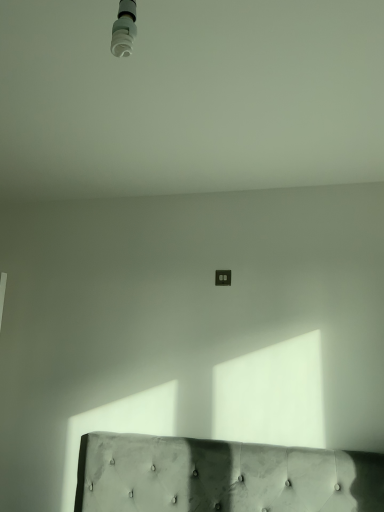
The height and width of the screenshot is (512, 384). In order to click on black plastic switch at center in this screenshot , I will do `click(223, 278)`.

What is the approximate height of black plastic switch at center?

black plastic switch at center is 3.45 inches tall.

The image size is (384, 512). Describe the element at coordinates (223, 278) in the screenshot. I see `black plastic switch at center` at that location.

The width and height of the screenshot is (384, 512). Identify the location of black plastic switch at center. (223, 278).